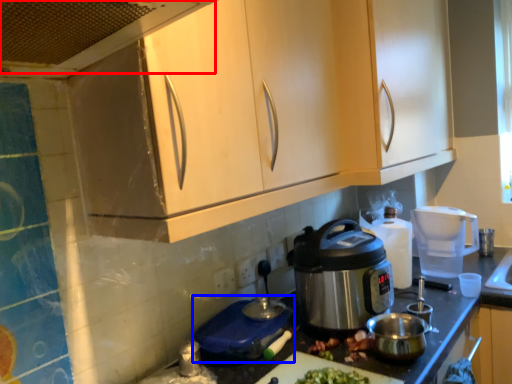
Question: Among these objects, which one is farthest to the camera, exhaust hood (highlighted by a red box) or appliance (highlighted by a blue box)?

Choices:
 (A) exhaust hood
 (B) appliance

Answer: (B)